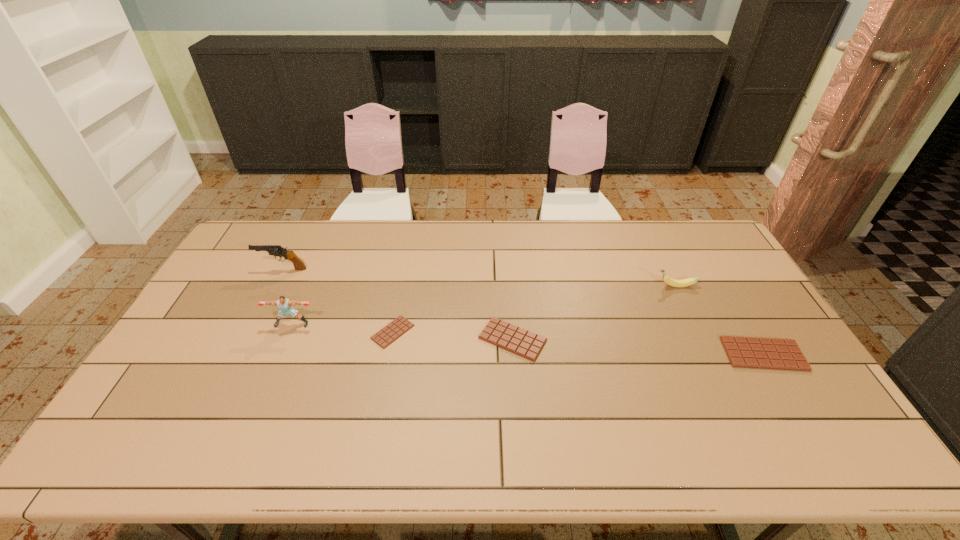
Please point a space for a new candy_bar to maintain equal intervals. Please provide its 2D coordinates. Your answer should be formatted as a tuple, i.e. [(x, y)], where the tuple contains the x and y coordinates of a point satisfying the conditions above.

[(636, 347)]